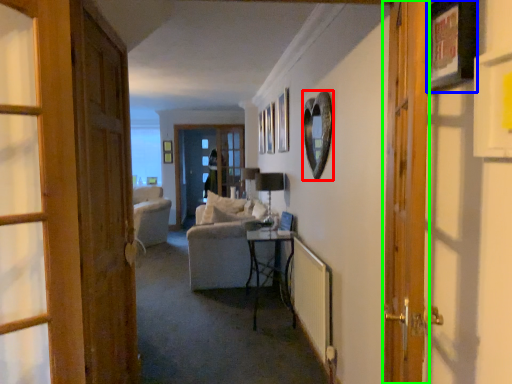
Question: Which is nearer to the picture frame (highlighted by a red box)? picture frame (highlighted by a blue box) or door (highlighted by a green box).

Choices:
 (A) picture frame
 (B) door

Answer: (B)